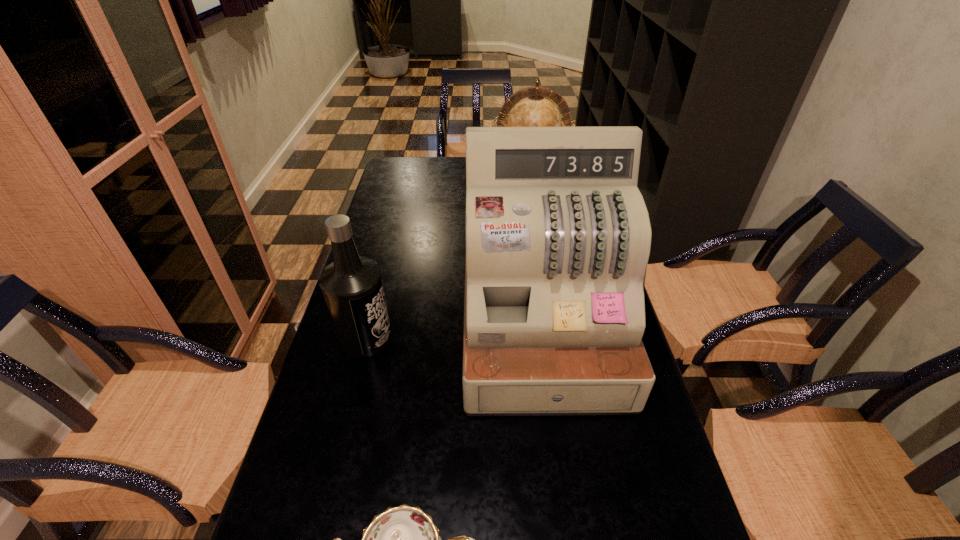
I want to click on object positioned at the far right corner, so click(529, 107).

Where is `vacant space at the far edge of the desktop`? vacant space at the far edge of the desktop is located at coordinates (448, 173).

In the image, there is a desktop. Find the location of `free space at the left edge`. free space at the left edge is located at coordinates (281, 527).

Identify the location of free spot at the right edge of the desktop. (619, 434).

Find the location of `free location at the far left corner of the desktop`. free location at the far left corner of the desktop is located at coordinates (415, 173).

Image resolution: width=960 pixels, height=540 pixels. I want to click on vacant point located between the cash register and the leftmost object, so click(x=453, y=337).

You are a GUI agent. You are given a task and a screenshot of the screen. Output one action in this format:
    pyautogui.click(x=<x>, y=<y>)
    Task: Click on the vacant region between the liquor and the tallest object
    The width and height of the screenshot is (960, 540).
    Given the screenshot: What is the action you would take?
    pyautogui.click(x=453, y=337)

Select which object is the closest to the tallest object. Please provide its 2D coordinates. Your answer should be formatted as a tuple, i.e. [(x, y)], where the tuple contains the x and y coordinates of a point satisfying the conditions above.

[(352, 286)]

What are the coordinates of `the third closest object to the shortest object` in the screenshot? It's located at (529, 107).

Identify the location of free spot that satisfies the following two spatial constraints: 1. on the operating side of the cash register; 2. on the front label of the liquor. (541, 338).